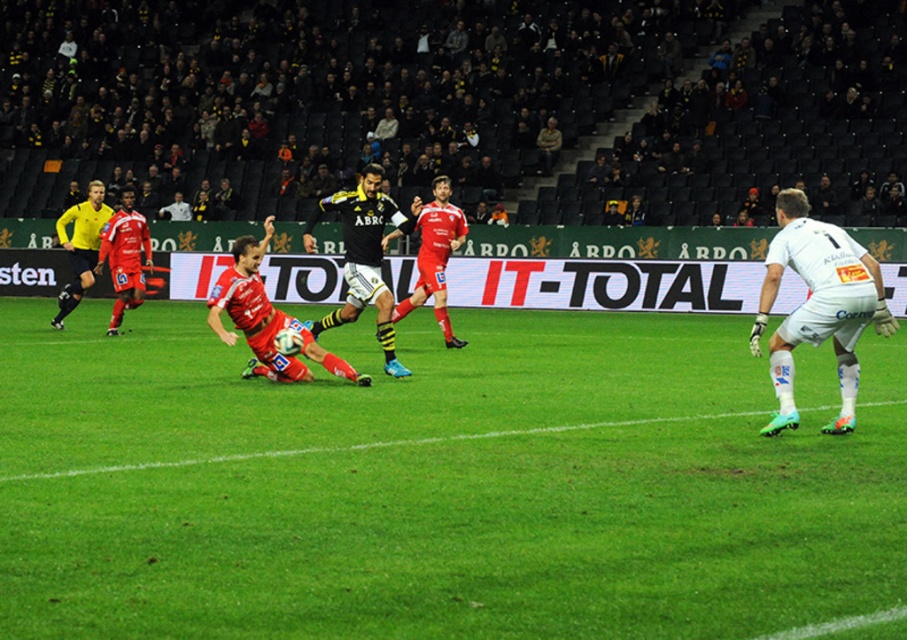
Can you confirm if matte red jersey at center is taller than yellow matte referee at left?

Yes.

Does point (442, 205) lie in front of point (96, 193)?

Yes, point (442, 205) is closer to viewer.

Where is `matte red jersey at center`? matte red jersey at center is located at coordinates pos(435,257).

Is point (793, 221) positioned after point (223, 336)?

No, (793, 221) is in front of (223, 336).

Which is more to the right, white matte jersey at right or red matte soccer player at center?

From the viewer's perspective, white matte jersey at right appears more on the right side.

You are a GUI agent. You are given a task and a screenshot of the screen. Output one action in this format:
    pyautogui.click(x=<x>, y=<y>)
    Task: Click on the white matte jersey at right
    The image size is (907, 640).
    Given the screenshot: What is the action you would take?
    pyautogui.click(x=818, y=305)

Where is `white matte jersey at right`? The width and height of the screenshot is (907, 640). white matte jersey at right is located at coordinates (818, 305).

What do you see at coordinates (367, 252) in the screenshot? I see `red matte soccer player at center` at bounding box center [367, 252].

Does red matte soccer player at center appear over black jersey at center?

Result: Indeed, red matte soccer player at center is positioned over black jersey at center.

Is point (274, 310) positioned behind point (366, 234)?

No.

Locate an element on the screen. The height and width of the screenshot is (640, 907). red matte soccer player at center is located at coordinates [367, 252].